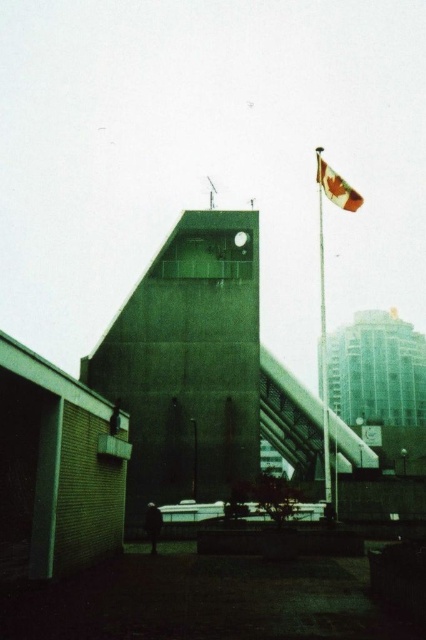
Question: Estimate the real-world distances between objects in this image. Which object is farther from the green concrete bell tower at center?

Choices:
 (A) red fabric flag at upper right
 (B) polished metal flag pole at upper right

Answer: (A)

Question: From the image, what is the correct spatial relationship of green concrete bell tower at center in relation to red fabric flag at upper right?

Choices:
 (A) below
 (B) above

Answer: (A)

Question: Is green concrete bell tower at center to the left of red fabric flag at upper right from the viewer's perspective?

Choices:
 (A) no
 (B) yes

Answer: (B)

Question: Which point appears closest to the camera in this image?

Choices:
 (A) (244, 278)
 (B) (325, 397)

Answer: (B)

Question: Which of the following is the farthest from the observer?

Choices:
 (A) (210, 296)
 (B) (322, 188)
 (C) (353, 196)

Answer: (A)

Question: Is polished metal flag pole at upper right thinner than red fabric flag at upper right?

Choices:
 (A) yes
 (B) no

Answer: (B)